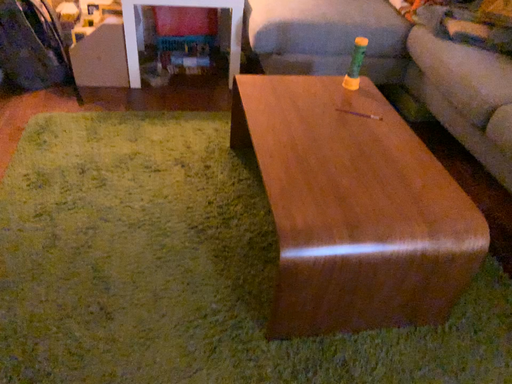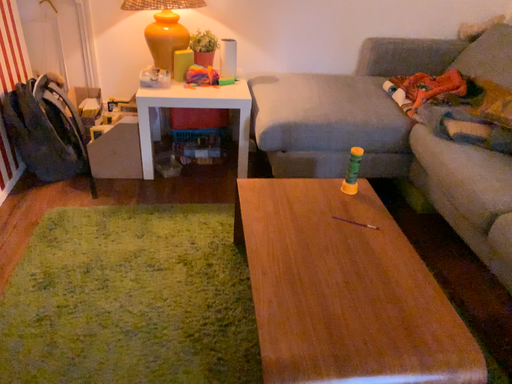
Question: Which way did the camera rotate in the video?

Choices:
 (A) rotated upward
 (B) rotated downward

Answer: (A)